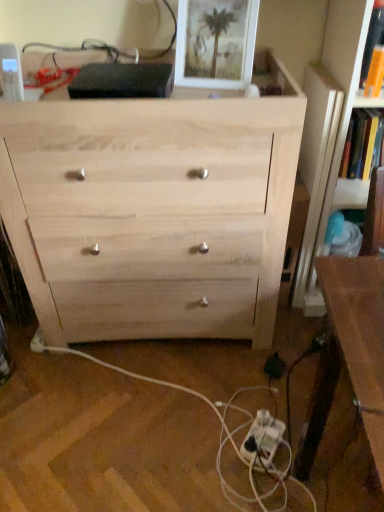
You are a GUI agent. You are given a task and a screenshot of the screen. Output one action in this format:
    pyautogui.click(x=<x>, y=<y>)
    Task: Click on the free point behind white plastic extension cord at lower center
    This screenshot has height=512, width=384.
    Given the screenshot: What is the action you would take?
    pyautogui.click(x=254, y=393)